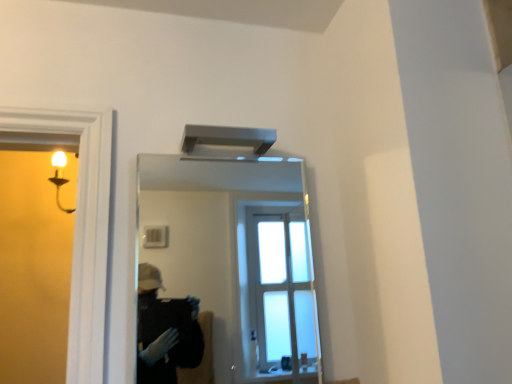
Question: From the image's perspective, would you say satin silver exhaust hood at upper center is positioned over clear glass mirror at upper center?

Choices:
 (A) yes
 (B) no

Answer: (A)

Question: Is satin silver exhaust hood at upper center to the right of clear glass mirror at upper center from the viewer's perspective?

Choices:
 (A) no
 (B) yes

Answer: (A)

Question: Is satin silver exhaust hood at upper center not near clear glass mirror at upper center?

Choices:
 (A) no
 (B) yes

Answer: (B)

Question: Is satin silver exhaust hood at upper center next to clear glass mirror at upper center and touching it?

Choices:
 (A) no
 (B) yes

Answer: (A)

Question: Considering the relative sizes of satin silver exhaust hood at upper center and clear glass mirror at upper center in the image provided, is satin silver exhaust hood at upper center shorter than clear glass mirror at upper center?

Choices:
 (A) no
 (B) yes

Answer: (B)

Question: From the image's perspective, would you say satin silver exhaust hood at upper center is shown under clear glass mirror at upper center?

Choices:
 (A) no
 (B) yes

Answer: (A)

Question: From a real-world perspective, is clear glass mirror at upper center on satin silver exhaust hood at upper center?

Choices:
 (A) yes
 (B) no

Answer: (B)

Question: Is clear glass mirror at upper center to the right of satin silver exhaust hood at upper center from the viewer's perspective?

Choices:
 (A) no
 (B) yes

Answer: (B)

Question: Does clear glass mirror at upper center turn towards satin silver exhaust hood at upper center?

Choices:
 (A) yes
 (B) no

Answer: (A)

Question: Does clear glass mirror at upper center have a larger size compared to satin silver exhaust hood at upper center?

Choices:
 (A) yes
 (B) no

Answer: (A)

Question: Can you confirm if clear glass mirror at upper center is thinner than satin silver exhaust hood at upper center?

Choices:
 (A) yes
 (B) no

Answer: (A)

Question: Is clear glass mirror at upper center placed right next to satin silver exhaust hood at upper center?

Choices:
 (A) yes
 (B) no

Answer: (B)

Question: Visually, is clear glass mirror at upper center positioned to the left or to the right of satin silver exhaust hood at upper center?

Choices:
 (A) right
 (B) left

Answer: (A)